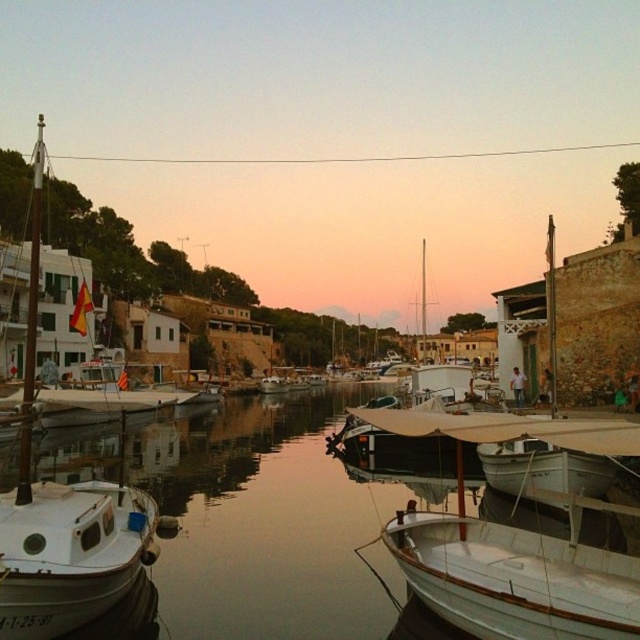
Question: Which of the following is the farthest from the observer?

Choices:
 (A) (12, 509)
 (B) (81, 632)
 (C) (595, 323)

Answer: (C)

Question: Which point appears farthest from the camera in this image?

Choices:
 (A) (129, 548)
 (B) (342, 444)

Answer: (B)

Question: Is white matte boat at left above white matte sailboat at center?

Choices:
 (A) yes
 (B) no

Answer: (A)

Question: Does smooth water at center have a smaller size compared to white matte boat at right?

Choices:
 (A) yes
 (B) no

Answer: (A)

Question: Which point is farther to the camera?

Choices:
 (A) white matte sailboat at center
 (B) white matte boat at left

Answer: (A)

Question: Does white matte boat at left have a greater width compared to white matte sailboat at center?

Choices:
 (A) yes
 (B) no

Answer: (A)